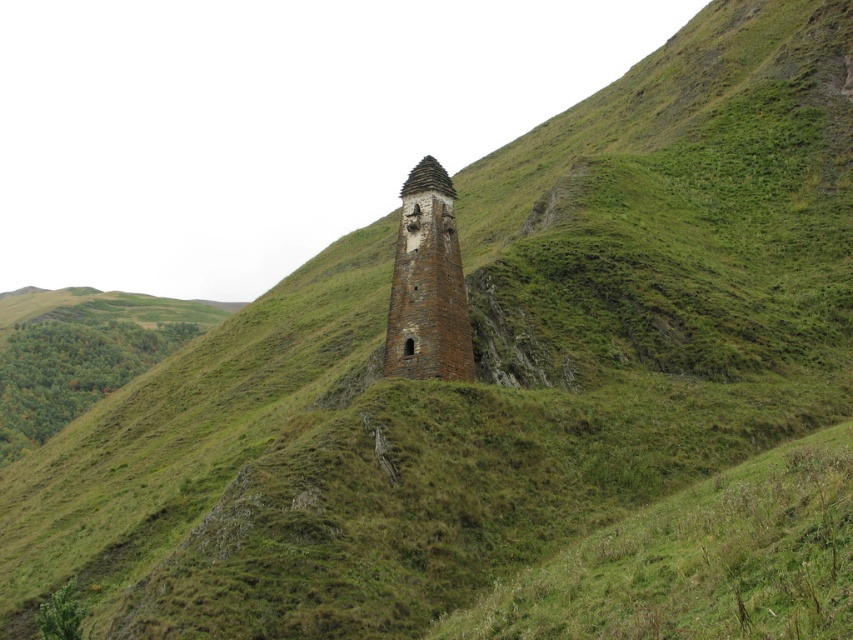
Who is positioned more to the right, brown stone tower at center or brown brick tower at center?

From the viewer's perspective, brown brick tower at center appears more on the right side.

How far apart are brown stone tower at center and brown brick tower at center?

They are 5.90 meters apart.

Between point (404, 284) and point (451, 188), which one is positioned behind?

Positioned behind is point (451, 188).

Identify the location of brown stone tower at center. This screenshot has width=853, height=640. (427, 284).